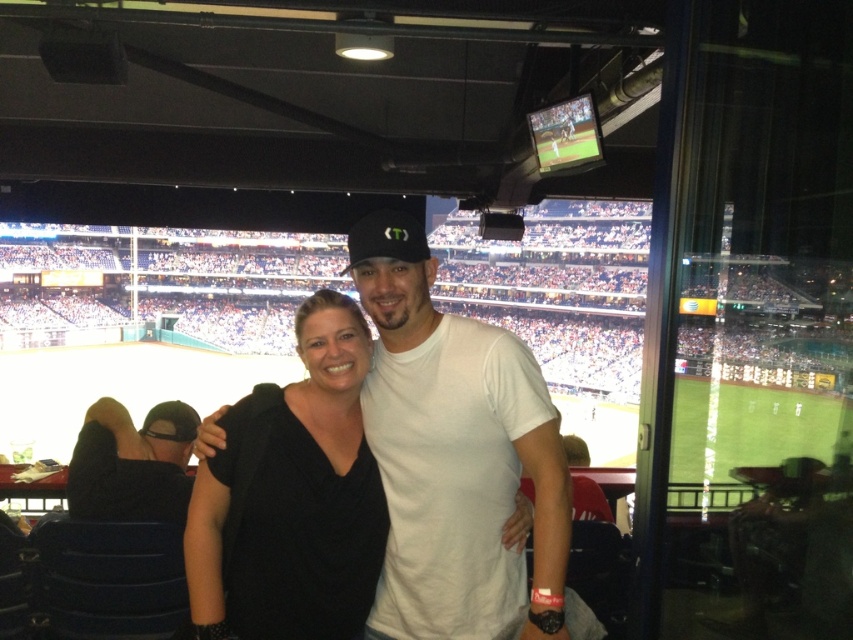
Question: Observing the image, what is the correct spatial positioning of white cotton t-shirt at center in reference to black matte shirt at center?

Choices:
 (A) right
 (B) left

Answer: (A)

Question: Can you confirm if black matte shirt at center is positioned to the left of black matte baseball cap at center?

Choices:
 (A) yes
 (B) no

Answer: (A)

Question: Which object is positioned closest to the black matte baseball cap at center?

Choices:
 (A) black matte shirt at center
 (B) white cotton t-shirt at center

Answer: (B)

Question: Which object appears farthest from the camera in this image?

Choices:
 (A) white cotton t-shirt at center
 (B) black matte baseball cap at center
 (C) black matte shirt at center

Answer: (B)

Question: Which point is closer to the camera?

Choices:
 (A) (351, 253)
 (B) (322, 320)

Answer: (A)

Question: In this image, where is black matte shirt at center located relative to black matte baseball cap at center?

Choices:
 (A) right
 (B) left

Answer: (B)